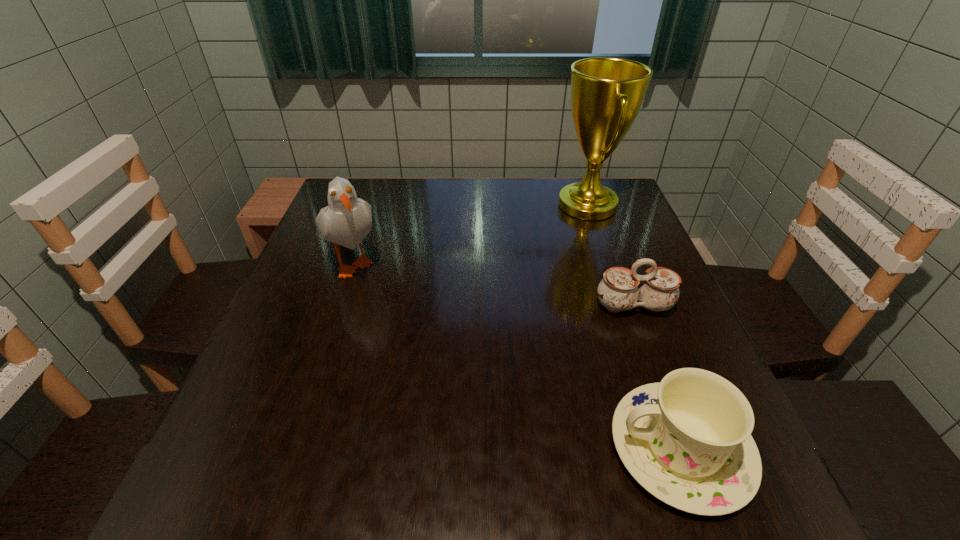
Locate an element on the screen. This screenshot has height=540, width=960. empty space that is in between the farther chinaware and the nearer chinaware is located at coordinates (657, 377).

Find the location of a particular element. This screenshot has height=540, width=960. vacant area that lies between the farther chinaware and the award is located at coordinates (611, 255).

Where is `vacant space that is in between the tallest object and the leftmost object`? The image size is (960, 540). vacant space that is in between the tallest object and the leftmost object is located at coordinates (470, 232).

Locate which object ranks third in proximity to the farther chinaware. Please provide its 2D coordinates. Your answer should be formatted as a tuple, i.e. [(x, y)], where the tuple contains the x and y coordinates of a point satisfying the conditions above.

[(347, 220)]

Locate an element on the screen. object identified as the third closest to the farther chinaware is located at coordinates (347, 220).

Where is `free space that satisfies the following two spatial constraints: 1. by the handles of the tallest object; 2. at the beak of the third shortest object`? The height and width of the screenshot is (540, 960). free space that satisfies the following two spatial constraints: 1. by the handles of the tallest object; 2. at the beak of the third shortest object is located at coordinates (606, 260).

You are a GUI agent. You are given a task and a screenshot of the screen. Output one action in this format:
    pyautogui.click(x=<x>, y=<y>)
    Task: Click on the blank area in the image that satisfies the following two spatial constraints: 1. by the handles of the tallest object; 2. at the beak of the leftmost object
    
    Given the screenshot: What is the action you would take?
    pyautogui.click(x=606, y=260)